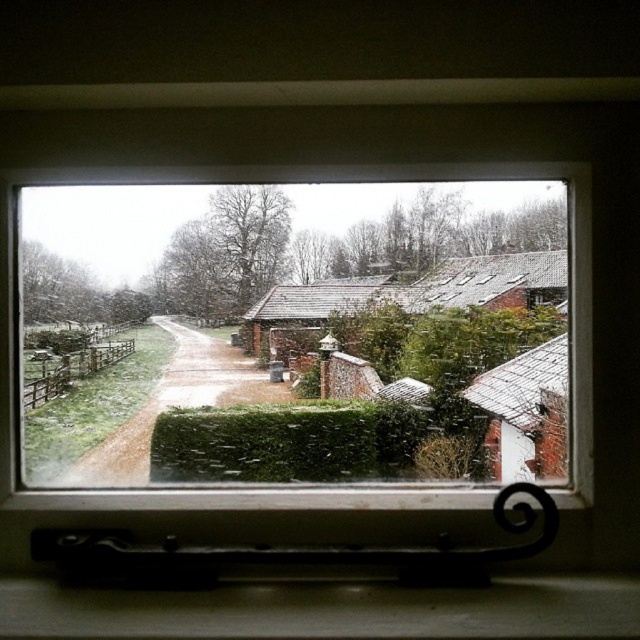
You are a window cleaner holding a ladder. You need to clean the clear glass window at center and the matte white sill at lower center. Which object should you clean first if you want to start from the lower position?

The matte white sill at lower center should be cleaned first because it is positioned lower than the clear glass window at center.

You are an interior designer assessing the window setup. The clear glass window at center and the matte white sill at lower center are part of the same window unit. Which component occupies more space in the window unit?

The clear glass window at center is larger in size than the matte white sill at lower center, so it occupies more space in the window unit.